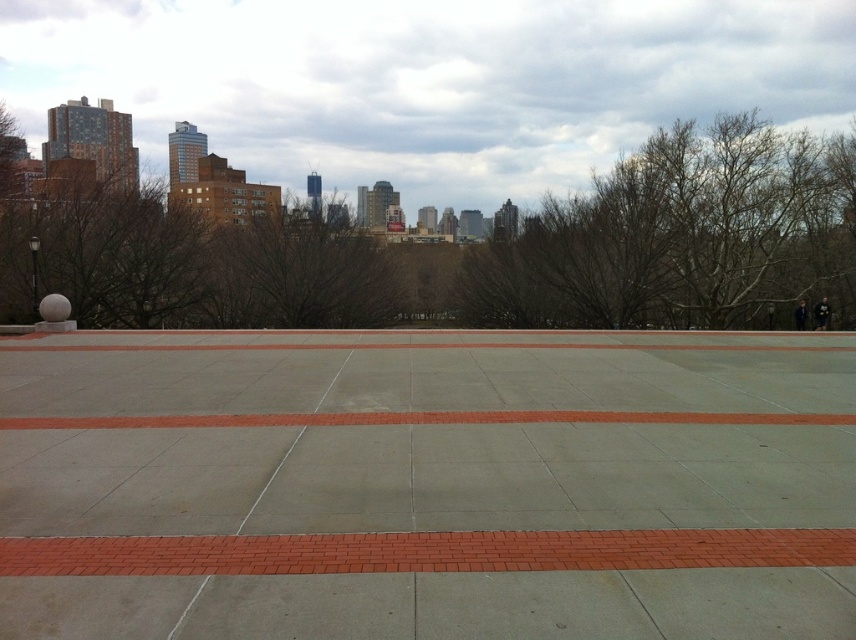
Question: Is brown leafless tree at left thinner than brown leafless tree at center?

Choices:
 (A) yes
 (B) no

Answer: (A)

Question: Does brown leafless tree at left appear on the left side of brown leafless tree at center?

Choices:
 (A) yes
 (B) no

Answer: (A)

Question: Which object appears closest to the camera in this image?

Choices:
 (A) concrete at center
 (B) brown leafless tree at left

Answer: (A)

Question: Can you confirm if concrete at center is positioned above brown leafless tree at center?

Choices:
 (A) yes
 (B) no

Answer: (B)

Question: Which object is the farthest from the brown leafless tree at left?

Choices:
 (A) brown leafless tree at center
 (B) bare branches at right

Answer: (B)

Question: Among these objects, which one is farthest from the camera?

Choices:
 (A) brown leafless tree at center
 (B) brown leafless tree at left
 (C) concrete at center
 (D) bare branches at right

Answer: (B)